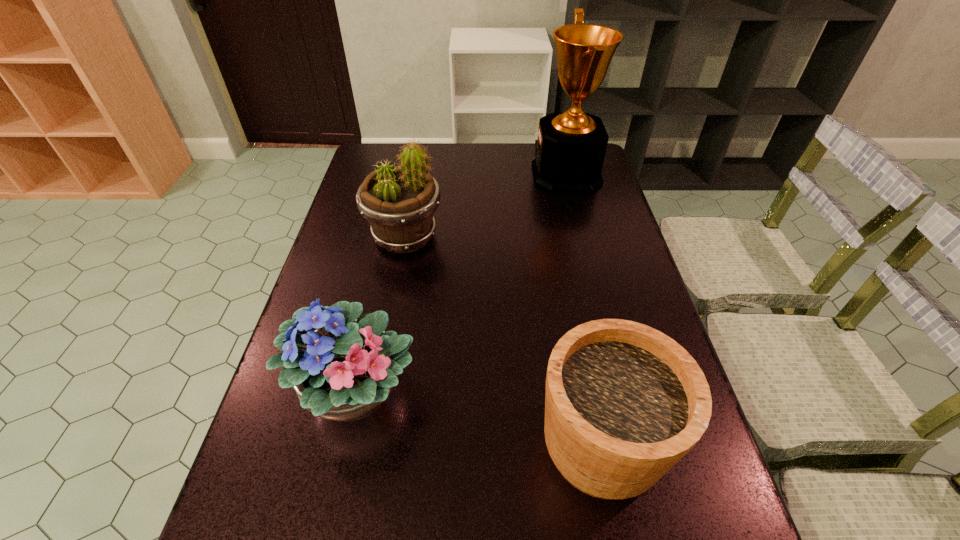
I want to click on the farthest object, so click(x=570, y=149).

The height and width of the screenshot is (540, 960). What are the coordinates of `trophy cup` in the screenshot? It's located at (570, 149).

This screenshot has width=960, height=540. I want to click on the taller flowerpot, so coord(399,202).

This screenshot has height=540, width=960. Identify the location of the second tallest object. (399, 202).

You are a GUI agent. You are given a task and a screenshot of the screen. Output one action in this format:
    pyautogui.click(x=<x>, y=<y>)
    Task: Click on the nearer flowerpot
    The image size is (960, 540).
    Given the screenshot: What is the action you would take?
    click(624, 402)

Identify the location of the shorter flowerpot. (624, 402).

Locate an element on the screen. bouquet is located at coordinates (343, 371).

Find the location of a particular element. vacant region located 0.060m on the front of the trophy cup with the label is located at coordinates (516, 174).

Locate an element on the screen. This screenshot has width=960, height=540. vacant space located on the front of the trophy cup with the label is located at coordinates (489, 174).

Find the location of a particular element. free space located on the front of the trophy cup with the label is located at coordinates (480, 174).